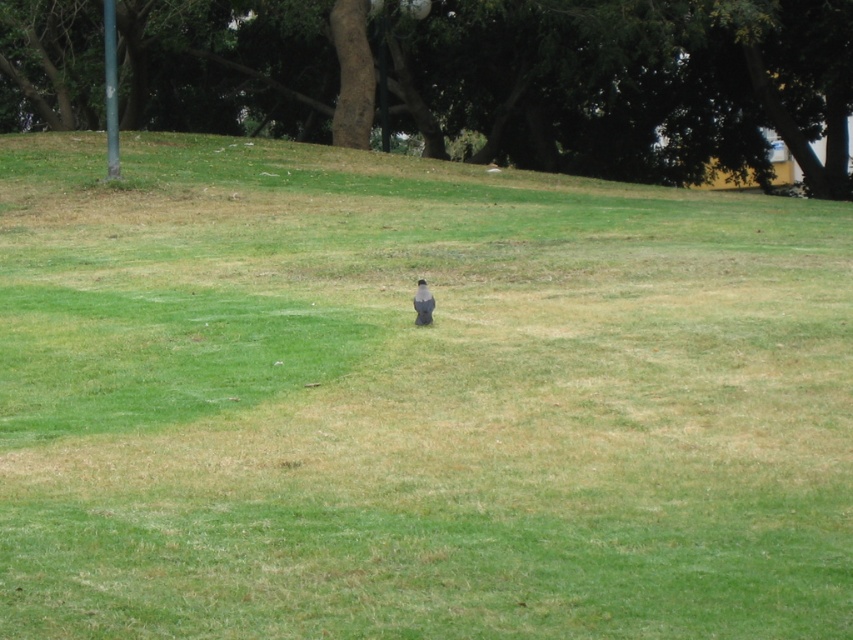
Question: Does brown textured tree at upper center appear under gray matte bird at center?

Choices:
 (A) no
 (B) yes

Answer: (A)

Question: Considering the relative positions of brown textured tree at upper center and gray matte bird at center in the image provided, where is brown textured tree at upper center located with respect to gray matte bird at center?

Choices:
 (A) below
 (B) above

Answer: (B)

Question: Is brown textured tree at upper center above gray matte bird at center?

Choices:
 (A) yes
 (B) no

Answer: (A)